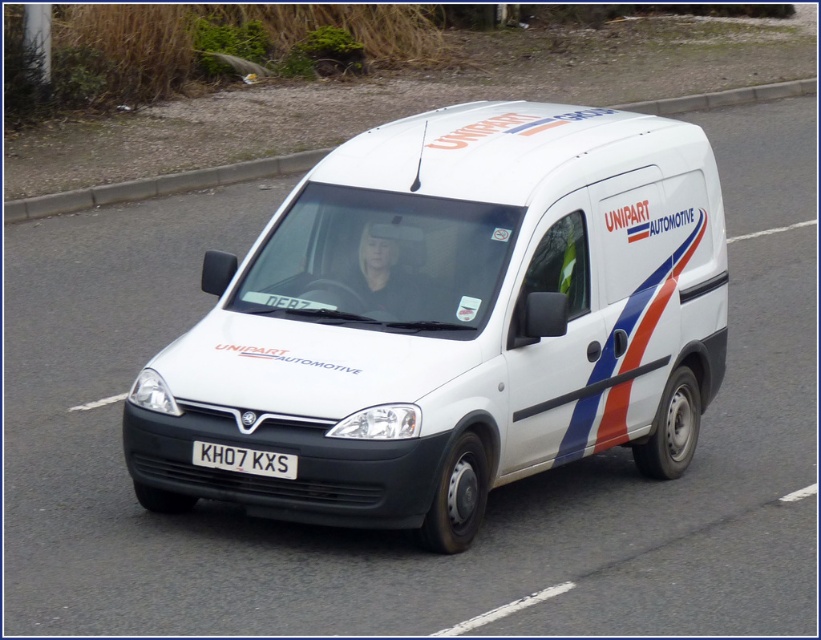
You are a delivery driver planning to park the UNIPART AUTOMOTIVE van on the road. The van has a length of 6 meters. The point marked as point (158, 186) is the location of the curb. Is there enough space to park the van completely on the road without crossing the curb?

The concrete at upper center represented by point (158, 186) is the curb. Since the van is 6 meters long, and the curb is at that point, there is sufficient space to park the van entirely on the road without crossing the curb as long as the driver aligns the van properly behind the curb point.

You are a delivery driver planning to park the white matte van at center in a parking spot that is the same size as the concrete at upper center. Will the van fit without overhanging?

The white matte van at center is narrower than the concrete at upper center, so it should fit within the parking spot without overhanging.

You are standing on the side of the road and see the white matte van at center approaching you. If the van is moving at 20 km per hour, how many seconds will it take for the van to reach you?

The white matte van at center is 7.16 meters away from you. At 20 km per hour, the van is traveling at approximately 5.56 meters per second. Dividing the distance by speed gives 7.16 meters divided by 5.56 mps equals approximately 1.29 seconds. So, it will take roughly 1.29 seconds for the van to reach you.